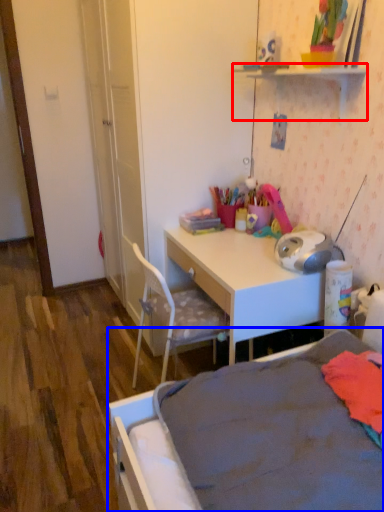
Question: Which point is further to the camera, shelf (highlighted by a red box) or bed (highlighted by a blue box)?

Choices:
 (A) shelf
 (B) bed

Answer: (A)